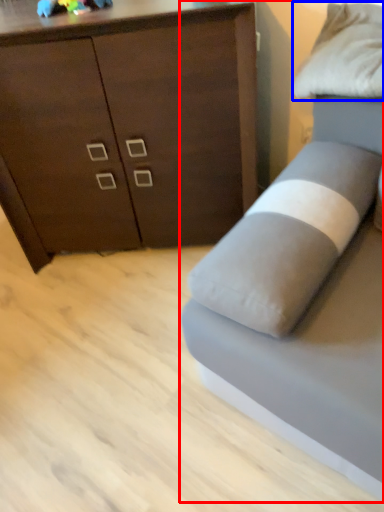
Question: Which object appears closest to the camera in this image, studio couch (highlighted by a red box) or pillow (highlighted by a blue box)?

Choices:
 (A) studio couch
 (B) pillow

Answer: (A)